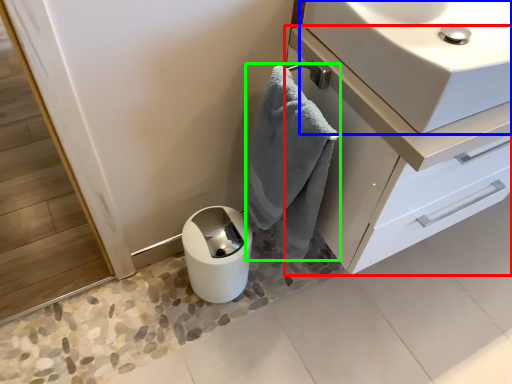
Question: Based on their relative distances, which object is farther from bathroom cabinet (highlighted by a red box)? Choose from sink (highlighted by a blue box) and bath towel (highlighted by a green box).

Choices:
 (A) sink
 (B) bath towel

Answer: (A)